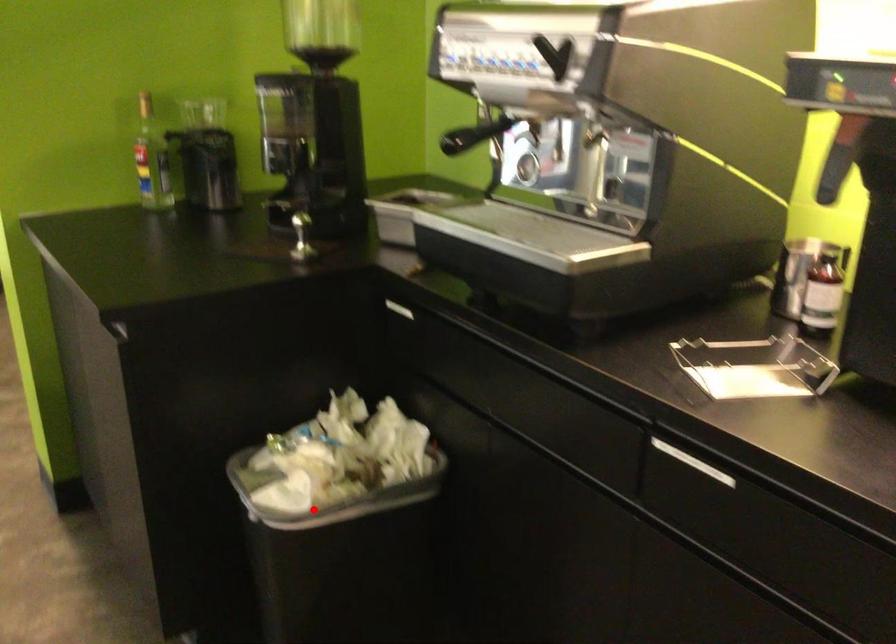
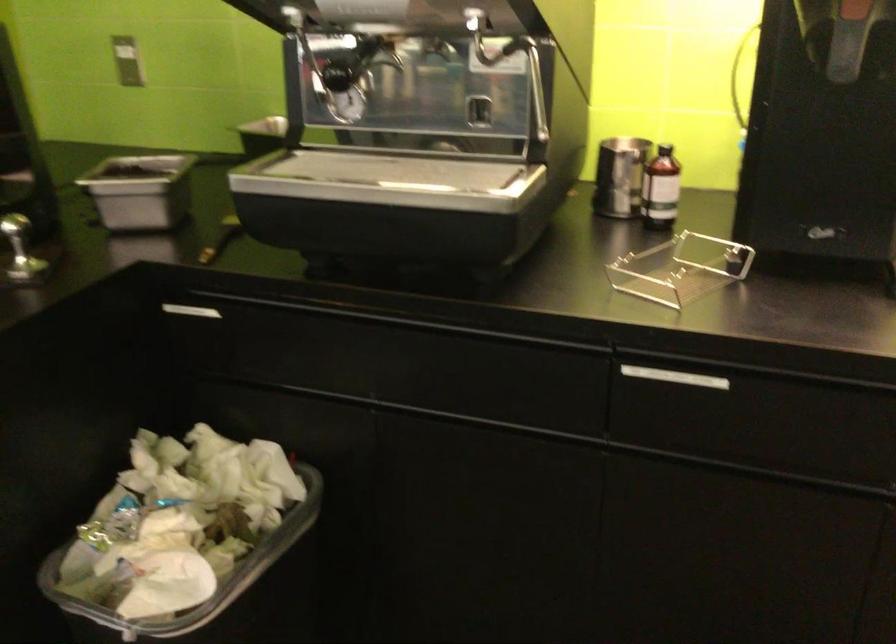
Where in the second image is the point corresponding to the highlighted location from the first image?

(218, 592)